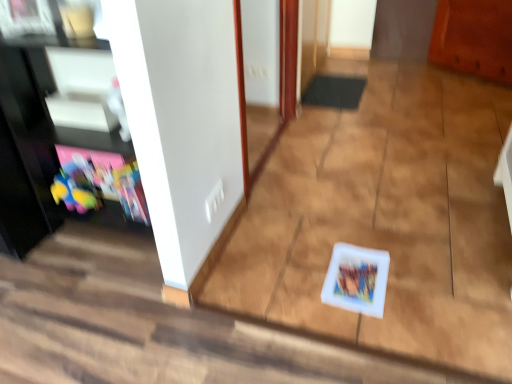
Question: Is white glossy door at center positioned before black rubber doormat at center?

Choices:
 (A) yes
 (B) no

Answer: (A)

Question: Is white glossy door at center at the left side of black rubber doormat at center?

Choices:
 (A) no
 (B) yes

Answer: (B)

Question: Does white glossy door at center have a greater height compared to black rubber doormat at center?

Choices:
 (A) no
 (B) yes

Answer: (B)

Question: Would you say white glossy door at center is outside black rubber doormat at center?

Choices:
 (A) no
 (B) yes

Answer: (B)

Question: From a real-world perspective, is white glossy door at center positioned under black rubber doormat at center based on gravity?

Choices:
 (A) yes
 (B) no

Answer: (B)

Question: Does white glossy door at center have a smaller size compared to black rubber doormat at center?

Choices:
 (A) no
 (B) yes

Answer: (A)

Question: Is white plastic book at center positioned far away from white glossy door at center?

Choices:
 (A) yes
 (B) no

Answer: (B)

Question: Is white plastic book at center directly adjacent to white glossy door at center?

Choices:
 (A) no
 (B) yes

Answer: (A)

Question: Does white plastic book at center turn towards white glossy door at center?

Choices:
 (A) yes
 (B) no

Answer: (B)

Question: Considering the relative positions of white plastic book at center and white glossy door at center in the image provided, is white plastic book at center to the right of white glossy door at center from the viewer's perspective?

Choices:
 (A) yes
 (B) no

Answer: (B)

Question: Is white plastic book at center located outside white glossy door at center?

Choices:
 (A) no
 (B) yes

Answer: (B)

Question: Is white plastic book at center oriented away from white glossy door at center?

Choices:
 (A) no
 (B) yes

Answer: (A)

Question: Does white glossy door at center lie behind white plastic book at center?

Choices:
 (A) no
 (B) yes

Answer: (B)